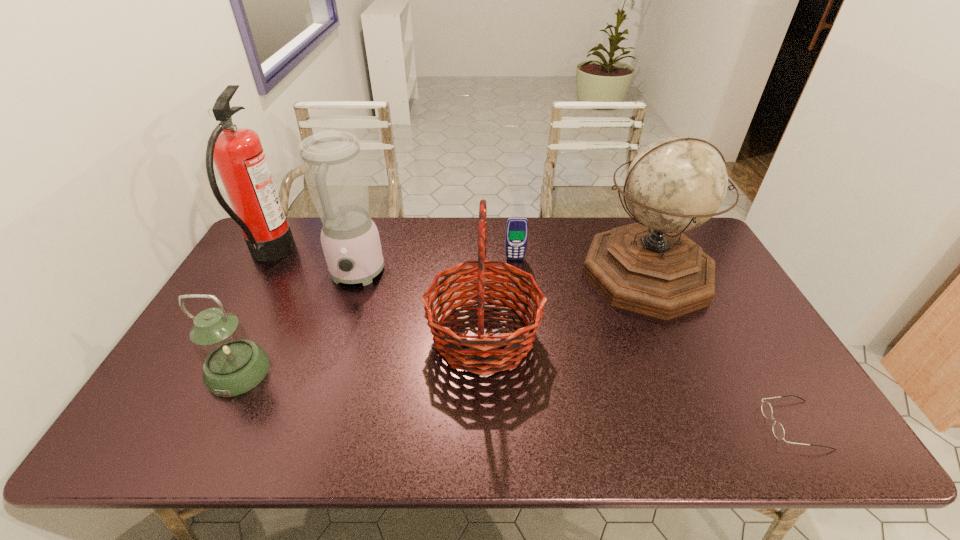
Where is `free region located 0.140m on the base of the food processor near the control knob`? Image resolution: width=960 pixels, height=540 pixels. free region located 0.140m on the base of the food processor near the control knob is located at coordinates (337, 334).

You are a GUI agent. You are given a task and a screenshot of the screen. Output one action in this format:
    pyautogui.click(x=<x>, y=<y>)
    Task: Click on the vacant space positioned on the back of the basket
    This screenshot has height=540, width=960.
    Given the screenshot: What is the action you would take?
    pyautogui.click(x=483, y=282)

Find the location of a particular element. Image resolution: width=960 pixels, height=540 pixels. vacant space located 0.110m on the front of the lantern is located at coordinates [x=204, y=440].

Find the location of `vacant space located on the front-facing side of the cellular telephone`. vacant space located on the front-facing side of the cellular telephone is located at coordinates (516, 271).

The height and width of the screenshot is (540, 960). In order to click on free point located through the lenses of the shortest object in this screenshot , I will do `click(618, 425)`.

Find the location of `free region located 0.280m through the lenses of the shortest object`. free region located 0.280m through the lenses of the shortest object is located at coordinates coord(645,425).

Where is `vacant space located through the lenses of the shortest object`? vacant space located through the lenses of the shortest object is located at coordinates (596, 425).

Image resolution: width=960 pixels, height=540 pixels. Find the location of `fire extinguisher at the far edge`. fire extinguisher at the far edge is located at coordinates (237, 153).

Identify the location of globe positioned at the far edge. The image size is (960, 540). (675, 184).

You are a GUI agent. You are given a task and a screenshot of the screen. Output one action in this format:
    pyautogui.click(x=<x>, y=<y>)
    Task: Click on the food processor that is at the far edge
    This screenshot has height=540, width=960.
    Given the screenshot: What is the action you would take?
    pyautogui.click(x=332, y=162)